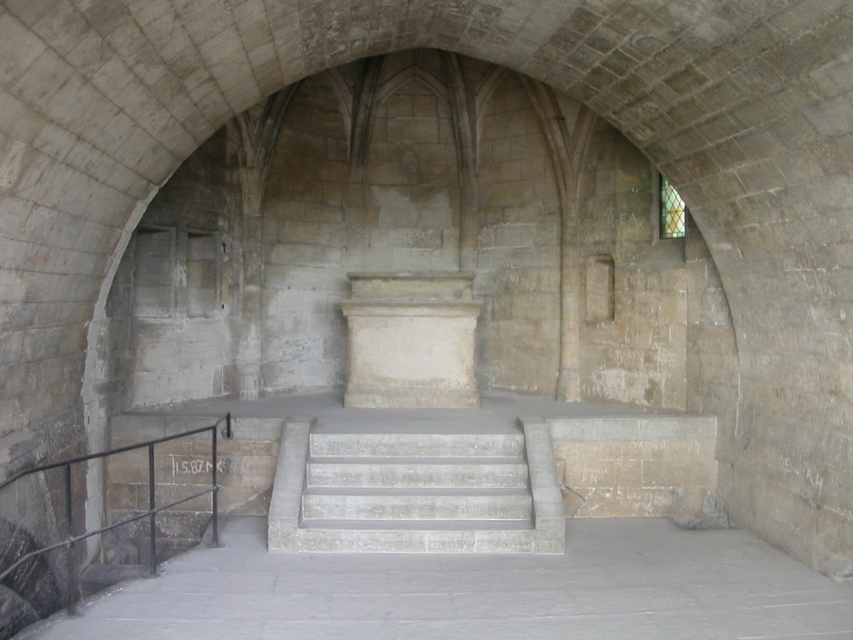
Consider the image. You are standing at the entrance of the chamber and want to place a sculpture on the highest point available. Which object should you choose between the white marble stairs at center and the white stone pedestal at center?

The white stone pedestal at center is taller than the white marble stairs at center, so you should place the sculpture on the white stone pedestal at center.

You are standing at the entrance of the chamber and see the point marked at (476,592). What material is present at that point?

The smooth gray cement at lower center is located at point (476,592).